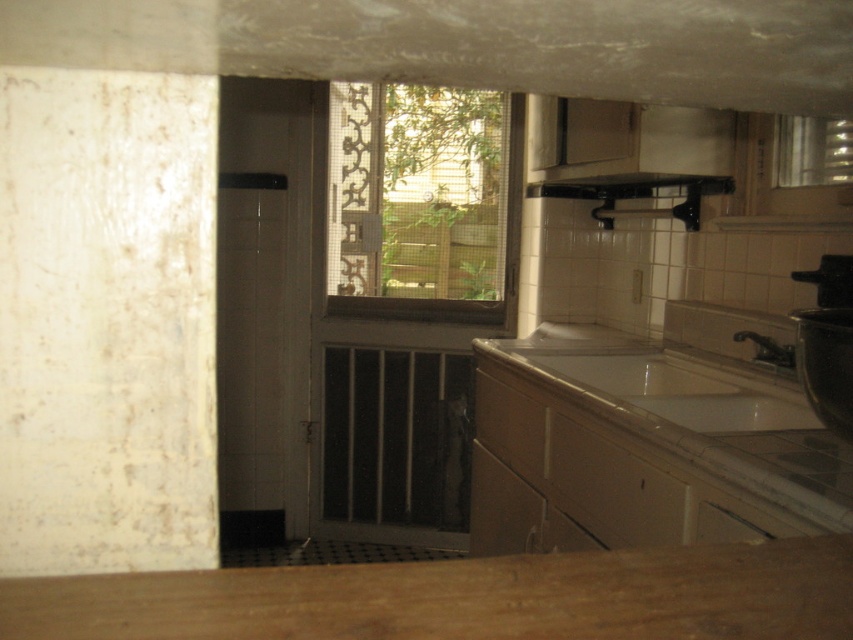
You are a kitchen designer planning to install a new appliance between the black matte exhaust hood at upper center and the white glossy sink at lower right. The appliance requires a minimum of 60 centimeters of space. Based on the current layout, is there enough space to accommodate this appliance?

The distance between the black matte exhaust hood at upper center and the white glossy sink at lower right is 63.84 centimeters, which exceeds the required 60 centimeters. Therefore, there is sufficient space to install the appliance.

You are trying to place a rectangular plate that is 10 cm thick on the wooden countertop at lower center and the clear glass window at center. Which surface can it fit on?

The wooden countertop at lower center is thinner than the clear glass window at center, so the plate with 10 cm thickness can fit on the clear glass window at center since it is thicker.

You are planning to install a new ventilation system in the kitchen. The ventilation system requires a space that is wider than the black matte exhaust hood at upper center. Do you think the clear glass window at center can accommodate it?

The clear glass window at center is wider than the black matte exhaust hood at upper center, so yes, the ventilation system can be accommodated there as it meets the width requirement.